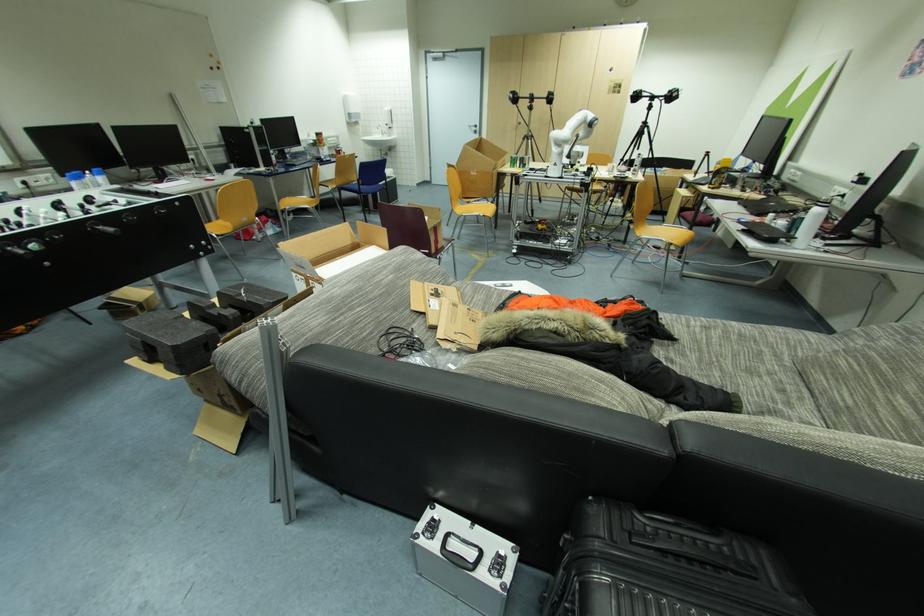
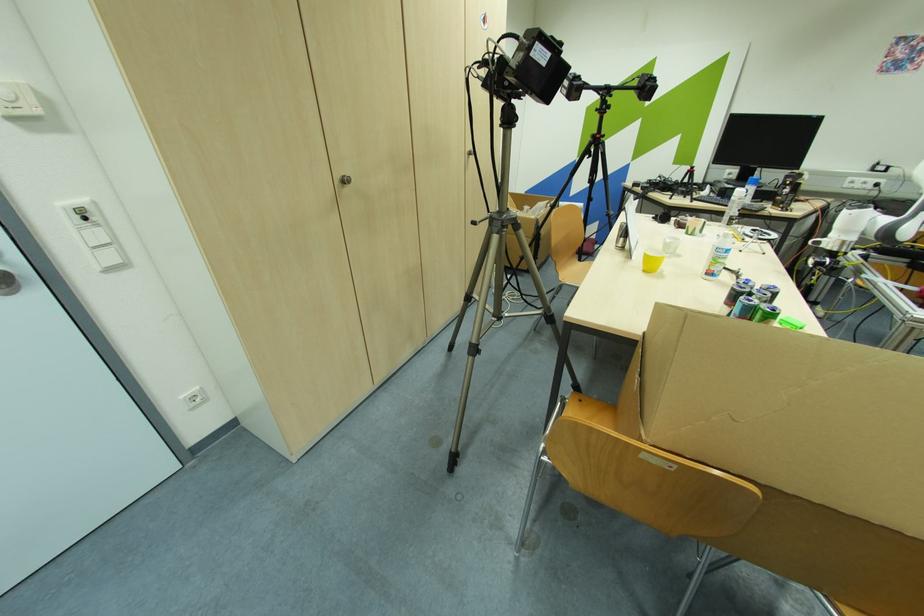
In the second image, find the point that corresponds to (523,124) in the first image.

(348, 182)